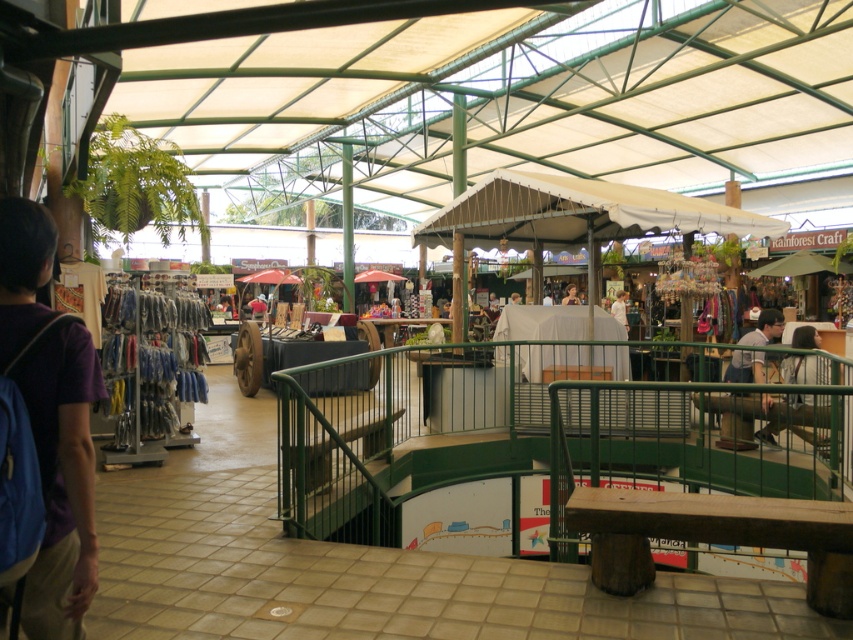
The width and height of the screenshot is (853, 640). Describe the element at coordinates (61, 477) in the screenshot. I see `purple fabric bag at lower left` at that location.

Is point (38, 355) closer to camera compared to point (805, 342)?

Yes, point (38, 355) is in front of point (805, 342).

Identify the location of purple fabric bag at lower left. (61, 477).

Does purple fabric bag at lower left have a lesser height compared to white fabric at center?

Incorrect, purple fabric bag at lower left's height does not fall short of white fabric at center's.

Is purple fabric bag at lower left positioned before white fabric at center?

Yes, it is in front of white fabric at center.

Is point (86, 346) closer to viewer compared to point (624, 314)?

Yes.

Find the location of `purple fabric bag at lower left`. purple fabric bag at lower left is located at coordinates (61, 477).

Does dark brown leather jacket at lower right have a smaller size compared to light brown wooden chair at center?

Yes.

Is dark brown leather jacket at lower right above light brown wooden chair at center?

No, dark brown leather jacket at lower right is not above light brown wooden chair at center.

Locate an element on the screen. This screenshot has width=853, height=640. dark brown leather jacket at lower right is located at coordinates (805, 337).